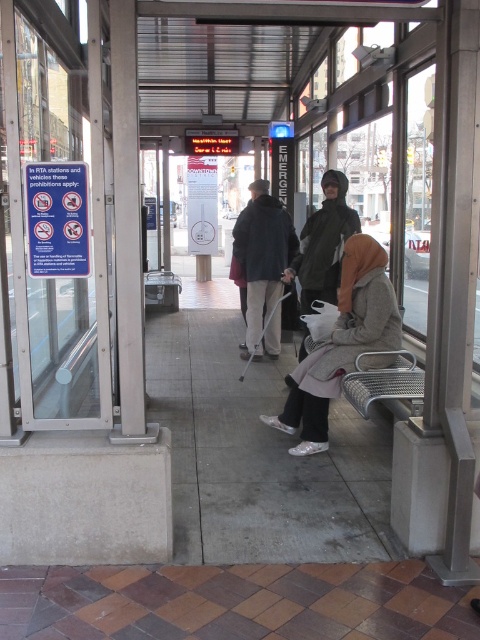
Is brown tile pavement at lower center to the right of dark green jacket at center from the viewer's perspective?

In fact, brown tile pavement at lower center is to the left of dark green jacket at center.

Can you confirm if brown tile pavement at lower center is thinner than dark green jacket at center?

In fact, brown tile pavement at lower center might be wider than dark green jacket at center.

Locate an element on the screen. This screenshot has height=640, width=480. brown tile pavement at lower center is located at coordinates (233, 602).

Locate an element on the screen. brown tile pavement at lower center is located at coordinates (233, 602).

Who is lower down, brown tile pavement at lower center or metallic silver bench at lower right?

brown tile pavement at lower center

Locate an element on the screen. The height and width of the screenshot is (640, 480). brown tile pavement at lower center is located at coordinates (233, 602).

Does dark green jacket at center appear over metallic silver bench at lower right?

Yes.

Is point (327, 173) in front of point (359, 362)?

No.

You are a GUI agent. You are given a task and a screenshot of the screen. Output one action in this format:
    pyautogui.click(x=<x>, y=<y>)
    Task: Click on the dark green jacket at center
    The width and height of the screenshot is (480, 640).
    Given the screenshot: What is the action you would take?
    pyautogui.click(x=324, y=243)